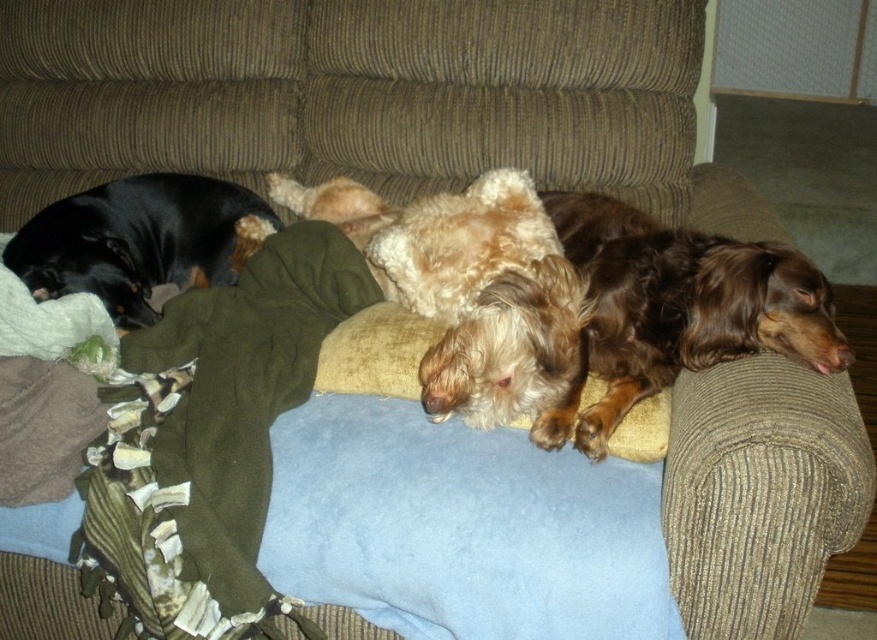
You are a dog trainer who needs to place a food bowl between the brown silky dog at right and the black smooth coat at left. The bowl requires 30 inches of space to avoid spills. Is there enough space between them?

The brown silky dog at right is 28.93 inches away from the black smooth coat at left. Since the required space is 30 inches, there isn not enough space between them to place the food bowl without risking spills.

You are a dog owner who wants to place a new cushion on the couch where the brown silky dog at right and the black smooth coat at left are resting. Based on their positions, where should you place the cushion so it doesn not disturb either dog?

The brown silky dog at right is positioned under the black smooth coat at left, so placing the cushion on the side opposite to the black smooth coat at left would avoid disturbing both dogs.